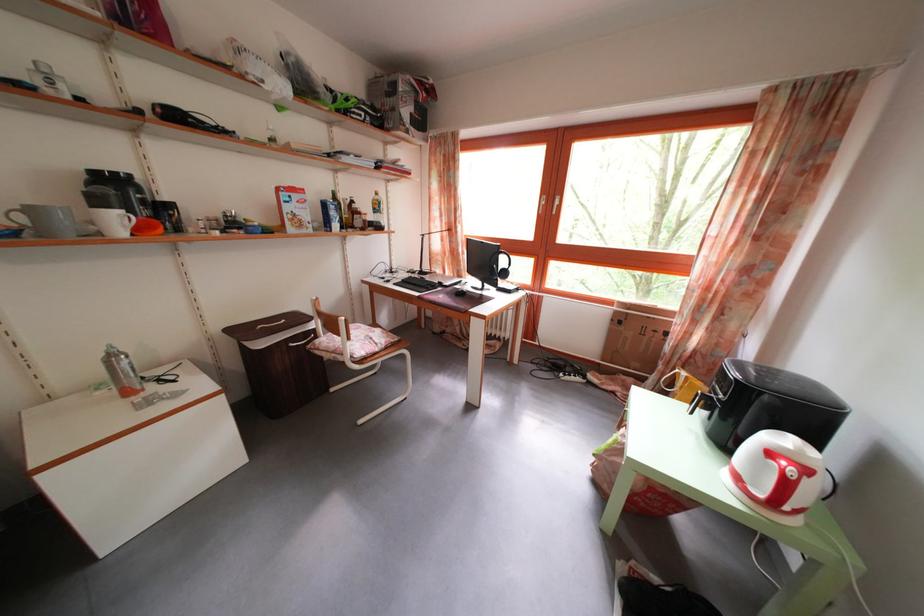
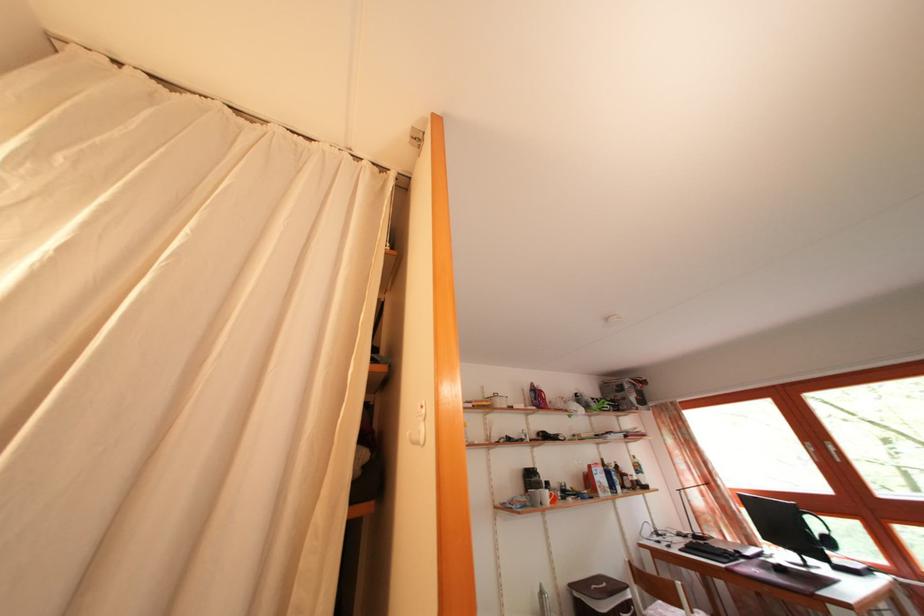
Where in the second image is the point corresponding to point (124, 197) from the first image?

(538, 484)